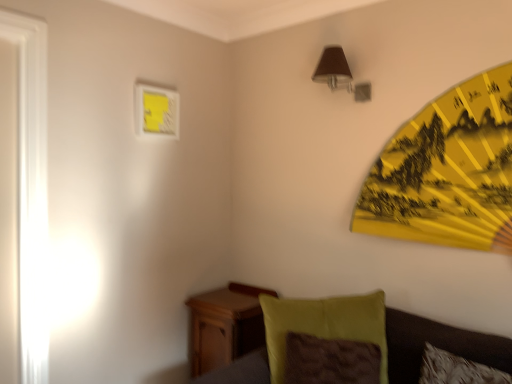
Question: Can you confirm if velvety green pillow at lower right is positioned to the left of wooden nightstand at lower left?

Choices:
 (A) yes
 (B) no

Answer: (B)

Question: Does velvety green pillow at lower right have a smaller size compared to wooden nightstand at lower left?

Choices:
 (A) yes
 (B) no

Answer: (A)

Question: Are velvety green pillow at lower right and wooden nightstand at lower left far apart?

Choices:
 (A) yes
 (B) no

Answer: (B)

Question: Can we say velvety green pillow at lower right lies outside wooden nightstand at lower left?

Choices:
 (A) yes
 (B) no

Answer: (A)

Question: Does velvety green pillow at lower right come behind wooden nightstand at lower left?

Choices:
 (A) yes
 (B) no

Answer: (B)

Question: Considering the relative sizes of velvety green pillow at lower right and wooden nightstand at lower left in the image provided, is velvety green pillow at lower right wider than wooden nightstand at lower left?

Choices:
 (A) yes
 (B) no

Answer: (B)

Question: Can you confirm if matte yellow picture frame at upper left is shorter than yellow paper umbrella at upper right?

Choices:
 (A) yes
 (B) no

Answer: (A)

Question: From the image's perspective, is matte yellow picture frame at upper left on top of yellow paper umbrella at upper right?

Choices:
 (A) no
 (B) yes

Answer: (B)

Question: From a real-world perspective, is matte yellow picture frame at upper left physically below yellow paper umbrella at upper right?

Choices:
 (A) no
 (B) yes

Answer: (A)

Question: Considering the relative sizes of matte yellow picture frame at upper left and yellow paper umbrella at upper right in the image provided, is matte yellow picture frame at upper left bigger than yellow paper umbrella at upper right?

Choices:
 (A) no
 (B) yes

Answer: (A)

Question: Considering the relative sizes of matte yellow picture frame at upper left and yellow paper umbrella at upper right in the image provided, is matte yellow picture frame at upper left smaller than yellow paper umbrella at upper right?

Choices:
 (A) no
 (B) yes

Answer: (B)

Question: From a real-world perspective, is matte yellow picture frame at upper left on top of yellow paper umbrella at upper right?

Choices:
 (A) no
 (B) yes

Answer: (B)

Question: From a real-world perspective, is brown fabric lampshade at upper right physically above wooden nightstand at lower left?

Choices:
 (A) no
 (B) yes

Answer: (B)